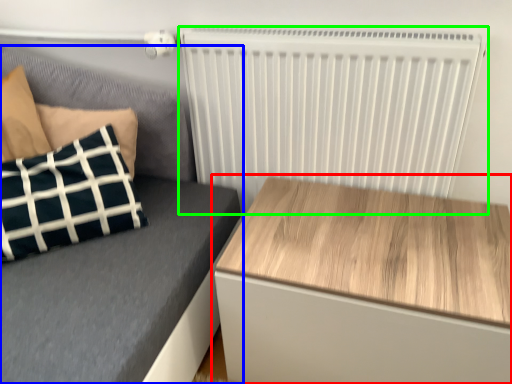
Question: Which object is the closest to the table (highlighted by a red box)? Choose among these: furniture (highlighted by a blue box) or radiator (highlighted by a green box).

Choices:
 (A) furniture
 (B) radiator

Answer: (B)